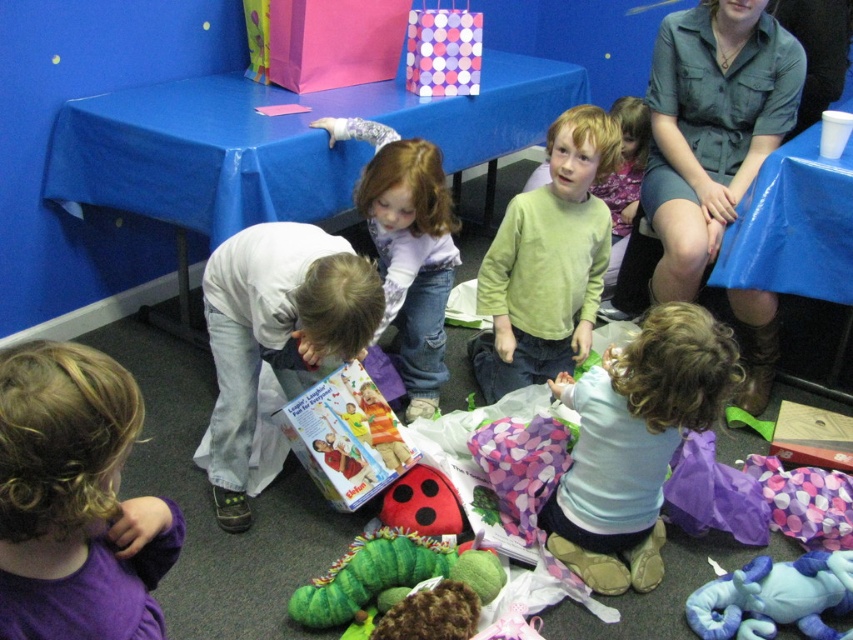
Question: Which is farther from the purple fleece shirt at lower left?

Choices:
 (A) denim shirt at upper right
 (B) light blue fabric at center

Answer: (A)

Question: Is denim shirt at upper right behind green matte shirt at center?

Choices:
 (A) no
 (B) yes

Answer: (B)

Question: Which object is positioned closest to the blue plush elephant at lower right?

Choices:
 (A) white matte shirt at center
 (B) purple fleece shirt at lower left
 (C) denim shirt at upper right

Answer: (C)

Question: Is purple fleece shirt at lower left thinner than white matte shirt at center?

Choices:
 (A) yes
 (B) no

Answer: (A)

Question: Observing the image, what is the correct spatial positioning of purple fleece shirt at lower left in reference to green matte shirt at center?

Choices:
 (A) below
 (B) above

Answer: (A)

Question: Based on their relative distances, which object is nearer to the light blue fabric at center?

Choices:
 (A) green matte shirt at center
 (B) light brown hair at center

Answer: (A)